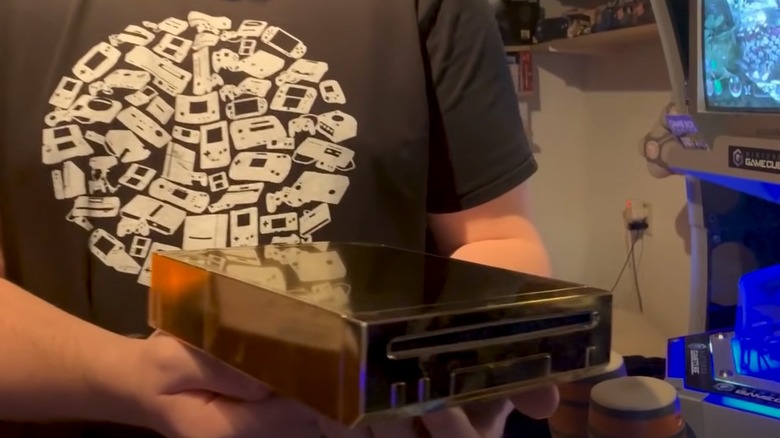
This screenshot has width=780, height=438. I want to click on cords, so click(636, 216), click(635, 230).